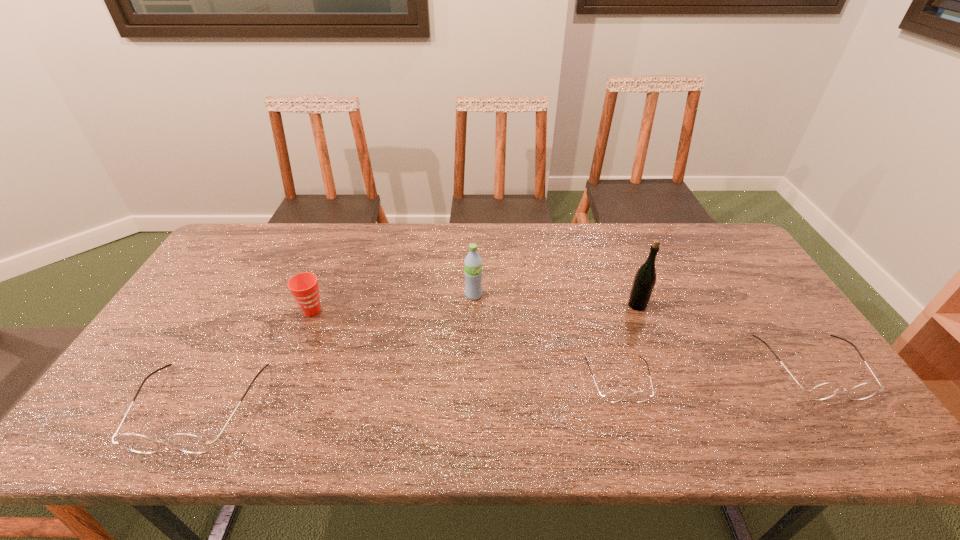
Where is `the leftmost object`? The width and height of the screenshot is (960, 540). the leftmost object is located at coordinates (189, 443).

In order to click on the shortest spectacles in this screenshot , I will do `click(613, 396)`.

Identify the location of the fourth object from left to right. The height and width of the screenshot is (540, 960). (613, 396).

You are a GUI agent. You are given a task and a screenshot of the screen. Output one action in this format:
    pyautogui.click(x=<x>, y=<y>)
    Task: Click on the second tallest spectacles
    Image resolution: width=960 pixels, height=540 pixels.
    Given the screenshot: What is the action you would take?
    pyautogui.click(x=823, y=391)

At what (x,y) coordinates should I click in order to perform the action: click on the rightmost spectacles. Please return your answer as a coordinate pair (x, y). Looking at the image, I should click on (823, 391).

This screenshot has height=540, width=960. I want to click on the second object from right to left, so click(x=645, y=278).

At what (x,y) coordinates should I click in order to perform the action: click on beer bottle. Please return your answer as a coordinate pair (x, y). This screenshot has height=540, width=960. Looking at the image, I should click on (645, 278).

Locate an element on the screen. The width and height of the screenshot is (960, 540). the fifth shortest object is located at coordinates (473, 262).

Locate an element on the screen. the fourth object from right to left is located at coordinates (473, 262).

Locate an element on the screen. The image size is (960, 540). the fourth shortest object is located at coordinates (304, 286).